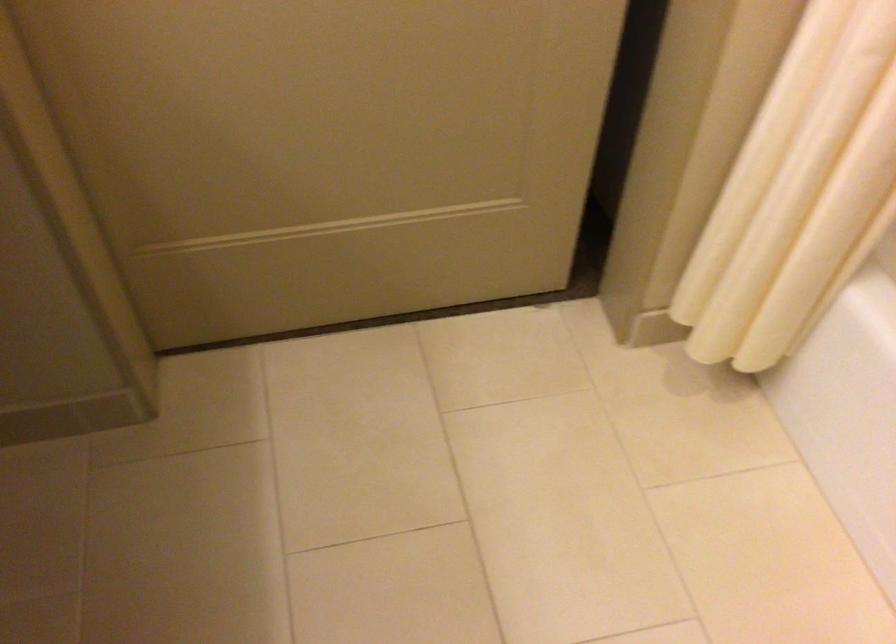
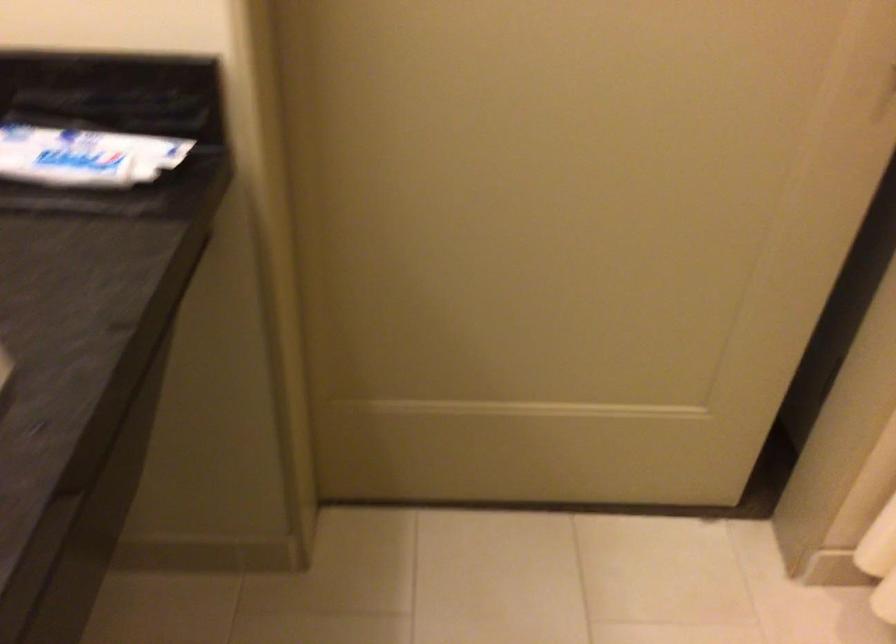
Question: What movement of the cameraman would produce the second image?

Choices:
 (A) Left
 (B) Right
 (C) Forward
 (D) Backward

Answer: (A)